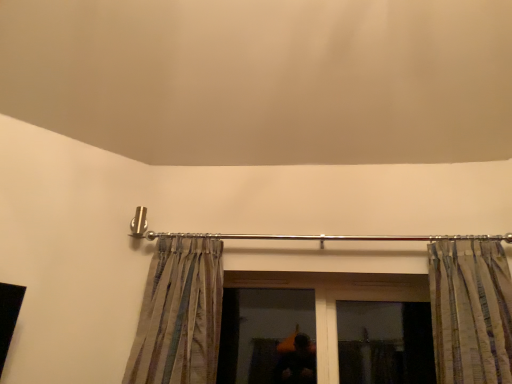
Question: Does transparent glass window at center have a greater width compared to silky striped curtain at left, the first curtain in the left-to-right sequence?

Choices:
 (A) no
 (B) yes

Answer: (A)

Question: Is transparent glass window at center surrounding silky striped curtain at left, which is the 2th curtain from right to left?

Choices:
 (A) no
 (B) yes

Answer: (A)

Question: Can you confirm if transparent glass window at center is positioned to the left of silky striped curtain at left, the first curtain in the left-to-right sequence?

Choices:
 (A) yes
 (B) no

Answer: (B)

Question: Is transparent glass window at center not inside silky striped curtain at left, the first curtain in the left-to-right sequence?

Choices:
 (A) yes
 (B) no

Answer: (A)

Question: From the image's perspective, does transparent glass window at center appear higher than silky striped curtain at left, which is the 2th curtain from right to left?

Choices:
 (A) no
 (B) yes

Answer: (A)

Question: Looking at their shapes, would you say striped fabric curtain at upper right, the 1th curtain positioned from the right, is wider or thinner than silky striped curtain at left, the first curtain in the left-to-right sequence?

Choices:
 (A) thin
 (B) wide

Answer: (B)

Question: From a real-world perspective, is striped fabric curtain at upper right, which ranks as the second curtain in left-to-right order, positioned above or below silky striped curtain at left, which is the 2th curtain from right to left?

Choices:
 (A) below
 (B) above

Answer: (B)

Question: Considering the positions of striped fabric curtain at upper right, which ranks as the second curtain in left-to-right order, and silky striped curtain at left, which is the 2th curtain from right to left, in the image, is striped fabric curtain at upper right, which ranks as the second curtain in left-to-right order, taller or shorter than silky striped curtain at left, which is the 2th curtain from right to left,?

Choices:
 (A) short
 (B) tall

Answer: (A)

Question: Is striped fabric curtain at upper right, which ranks as the second curtain in left-to-right order, situated inside silky striped curtain at left, the first curtain in the left-to-right sequence, or outside?

Choices:
 (A) inside
 (B) outside

Answer: (B)

Question: From a real-world perspective, is striped fabric curtain at upper right, the 1th curtain positioned from the right, positioned above or below transparent glass window at center?

Choices:
 (A) below
 (B) above

Answer: (B)

Question: Based on their sizes in the image, would you say striped fabric curtain at upper right, which ranks as the second curtain in left-to-right order, is bigger or smaller than transparent glass window at center?

Choices:
 (A) big
 (B) small

Answer: (A)

Question: In the image, is striped fabric curtain at upper right, the 1th curtain positioned from the right, positioned in front of or behind transparent glass window at center?

Choices:
 (A) behind
 (B) front

Answer: (B)

Question: Is point (487, 327) closer or farther from the camera than point (239, 367)?

Choices:
 (A) closer
 (B) farther

Answer: (A)

Question: Is silky striped curtain at left, the first curtain in the left-to-right sequence, bigger or smaller than transparent glass window at center?

Choices:
 (A) big
 (B) small

Answer: (A)

Question: Relative to transparent glass window at center, is silky striped curtain at left, the first curtain in the left-to-right sequence, in front or behind?

Choices:
 (A) behind
 (B) front

Answer: (B)